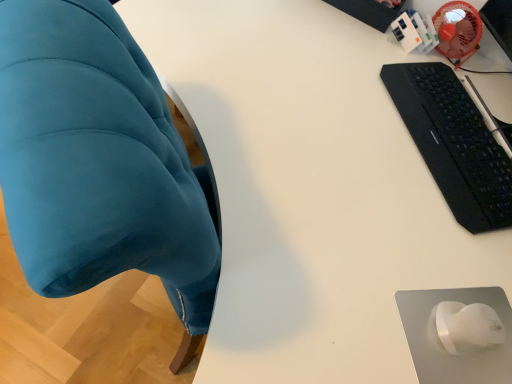
The height and width of the screenshot is (384, 512). I want to click on free region under black matte keyboard at right (from a real-world perspective), so click(454, 141).